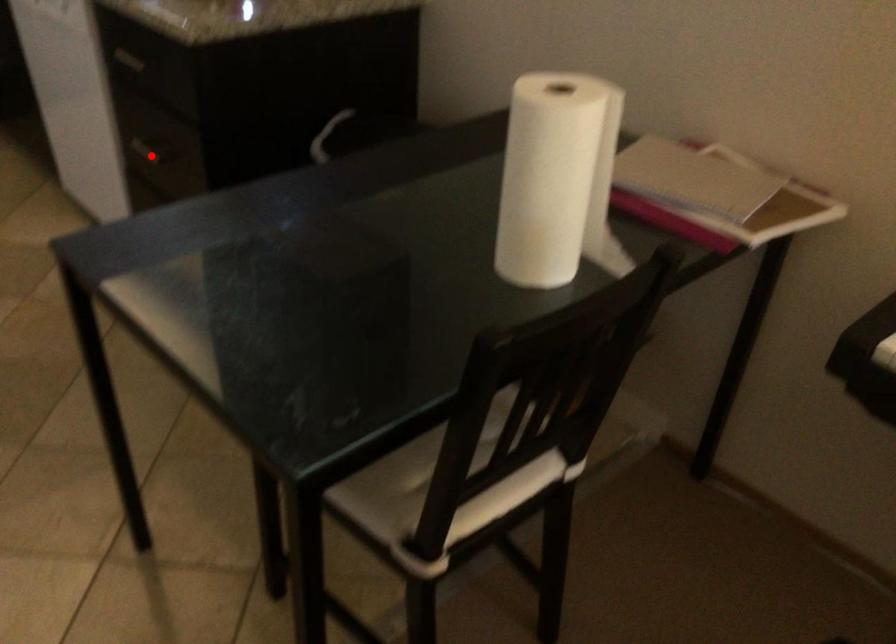
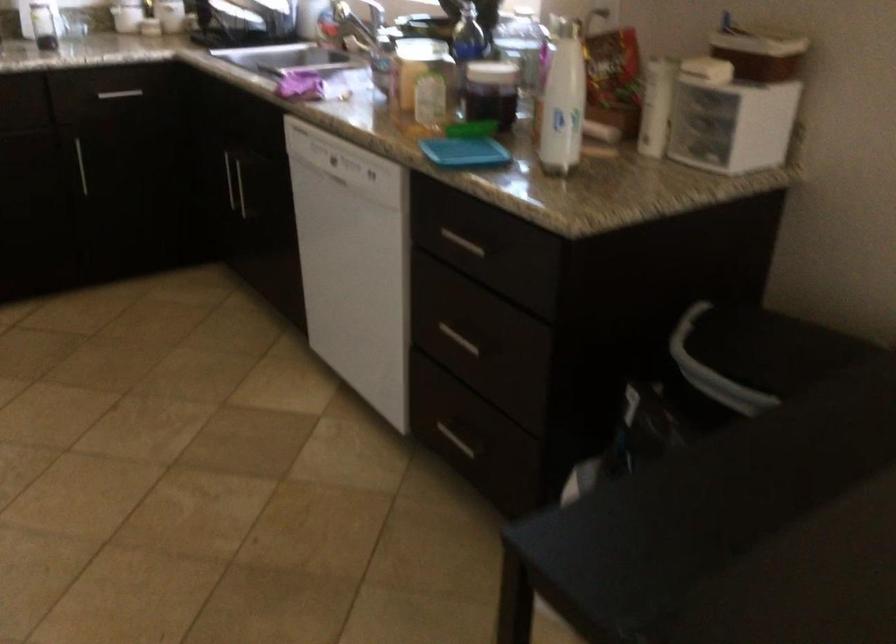
Where in the second image is the point corresponding to the highlighted location from the first image?

(459, 339)